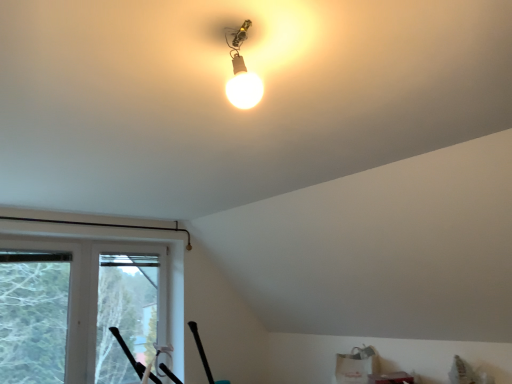
Question: Should I look upward or downward to see transparent plastic window screen at lower left, which appears as the second window screen when viewed from the left?

Choices:
 (A) up
 (B) down

Answer: (B)

Question: Is transparent plastic window screen at lower left, which appears as the second window screen when viewed from the left, further to camera compared to transparent plastic window screen at left, which is counted as the 1th window screen, starting from the left?

Choices:
 (A) no
 (B) yes

Answer: (B)

Question: Is transparent plastic window screen at lower left, which appears as the first window screen when viewed from the right, to the left of transparent plastic window screen at left, which is the 2th window screen from right to left, from the viewer's perspective?

Choices:
 (A) no
 (B) yes

Answer: (A)

Question: Is transparent plastic window screen at lower left, which appears as the second window screen when viewed from the left, facing away from transparent plastic window screen at left, which is the 2th window screen from right to left?

Choices:
 (A) yes
 (B) no

Answer: (B)

Question: Can transparent plastic window screen at left, which is counted as the 1th window screen, starting from the left, be found inside transparent plastic window screen at lower left, which appears as the first window screen when viewed from the right?

Choices:
 (A) yes
 (B) no

Answer: (B)

Question: Does transparent plastic window screen at lower left, which appears as the second window screen when viewed from the left, have a lesser width compared to transparent plastic window screen at left, which is the 2th window screen from right to left?

Choices:
 (A) no
 (B) yes

Answer: (A)

Question: Is transparent plastic window screen at lower left, which appears as the first window screen when viewed from the right, in front of transparent plastic window screen at left, which is the 2th window screen from right to left?

Choices:
 (A) yes
 (B) no

Answer: (B)

Question: From the image's perspective, is transparent plastic window screen at left, which is counted as the 1th window screen, starting from the left, on top of matte glass bulb at upper center?

Choices:
 (A) yes
 (B) no

Answer: (B)

Question: Can you confirm if transparent plastic window screen at left, which is the 2th window screen from right to left, is wider than matte glass bulb at upper center?

Choices:
 (A) yes
 (B) no

Answer: (B)

Question: Is transparent plastic window screen at left, which is counted as the 1th window screen, starting from the left, completely or partially outside of matte glass bulb at upper center?

Choices:
 (A) no
 (B) yes

Answer: (B)

Question: Is transparent plastic window screen at left, which is counted as the 1th window screen, starting from the left, closer to camera compared to matte glass bulb at upper center?

Choices:
 (A) yes
 (B) no

Answer: (B)

Question: From a real-world perspective, does transparent plastic window screen at left, which is the 2th window screen from right to left, stand above matte glass bulb at upper center?

Choices:
 (A) yes
 (B) no

Answer: (B)

Question: Considering the relative sizes of transparent plastic window screen at left, which is the 2th window screen from right to left, and matte glass bulb at upper center in the image provided, is transparent plastic window screen at left, which is the 2th window screen from right to left, thinner than matte glass bulb at upper center?

Choices:
 (A) yes
 (B) no

Answer: (A)

Question: From the image's perspective, would you say matte glass bulb at upper center is positioned over transparent plastic window screen at lower left, which appears as the first window screen when viewed from the right?

Choices:
 (A) no
 (B) yes

Answer: (B)